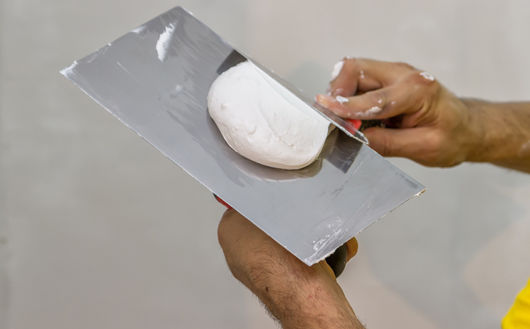
This screenshot has width=530, height=329. I want to click on wall, so click(x=424, y=242).